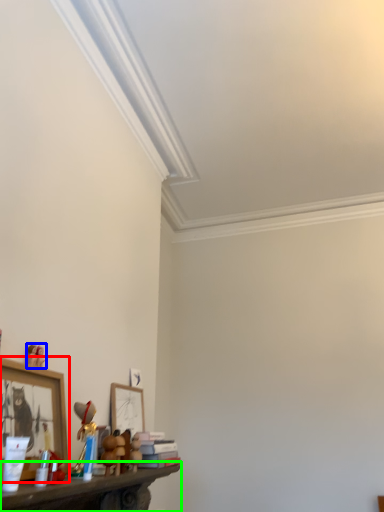
Question: Which object is positioned closest to picture frame (highlighted by a red box)? Select from toy (highlighted by a blue box) and shelf (highlighted by a green box).

Choices:
 (A) toy
 (B) shelf

Answer: (A)